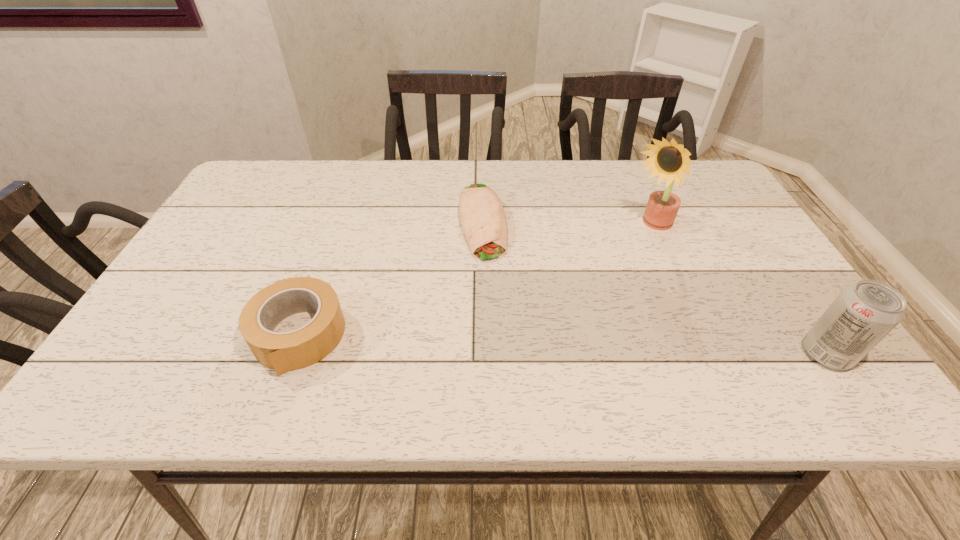
At what (x,y) coordinates should I click in order to perform the action: click on the second shortest object. Please return your answer as a coordinate pair (x, y). The image size is (960, 540). Looking at the image, I should click on coord(282,351).

At what (x,y) coordinates should I click in order to perform the action: click on the leftmost object. Please return your answer as a coordinate pair (x, y). Looking at the image, I should click on (282, 351).

You are a GUI agent. You are given a task and a screenshot of the screen. Output one action in this format:
    pyautogui.click(x=<x>, y=<y>)
    Task: Click on the rightmost object
    
    Given the screenshot: What is the action you would take?
    pyautogui.click(x=864, y=313)

Where is `the second tallest object`? the second tallest object is located at coordinates (864, 313).

Identify the location of the shortest object. (483, 219).

Locate an element on the screen. This screenshot has height=540, width=960. burrito is located at coordinates pos(483,219).

Locate an element on the screen. This screenshot has height=540, width=960. sunflower is located at coordinates (668, 160).

The height and width of the screenshot is (540, 960). Identify the location of the third object from left to right. (668, 160).

The width and height of the screenshot is (960, 540). Identify the location of free space located 0.120m on the left of the third shortest object. (745, 354).

Identify the location of vacant space located 0.260m at the bitten end of the second object from left to right. (503, 347).